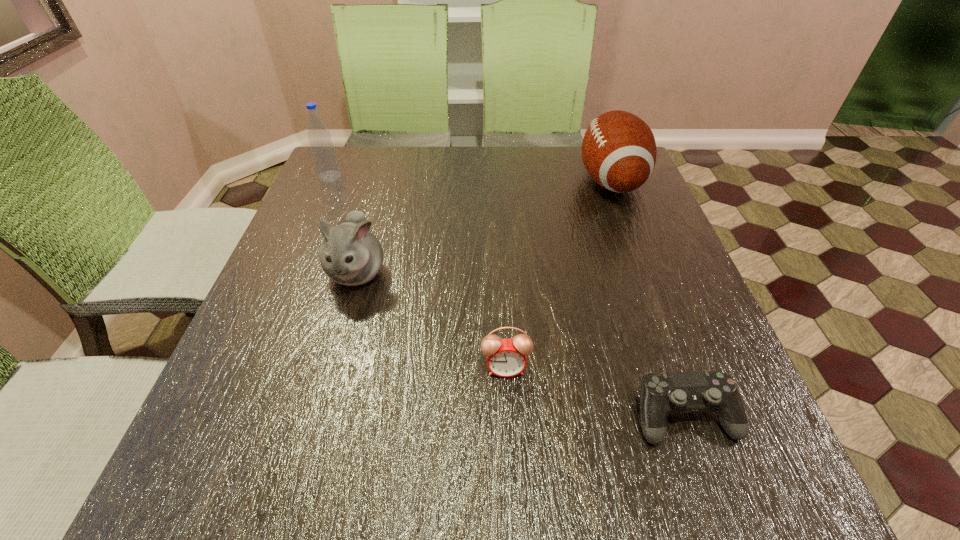
Locate an element on the screen. This screenshot has width=960, height=540. free point located 0.250m on the laces of the football is located at coordinates (487, 181).

Find the location of a particular element. This screenshot has width=960, height=540. vacant space located 0.190m on the laces of the football is located at coordinates (509, 181).

This screenshot has width=960, height=540. Find the location of `free space located on the face of the hamster`. free space located on the face of the hamster is located at coordinates (328, 374).

Locate an element on the screen. This screenshot has width=960, height=540. free spot located on the clock face of the fourth farthest object is located at coordinates (510, 464).

This screenshot has width=960, height=540. Identify the location of blank space located on the back of the nearest object. (648, 311).

Identify the location of water bottle present at the far edge. (323, 152).

Where is `football at the far edge`? Image resolution: width=960 pixels, height=540 pixels. football at the far edge is located at coordinates (x=619, y=151).

Where is `object that is at the near edge`? object that is at the near edge is located at coordinates (661, 394).

You are a GUI agent. You are given a task and a screenshot of the screen. Output one action in this format:
    pyautogui.click(x=<x>, y=<y>)
    Task: Click on the water bottle present at the left edge
    The width and height of the screenshot is (960, 540).
    Given the screenshot: What is the action you would take?
    pyautogui.click(x=323, y=152)

Locate an element on the screen. The height and width of the screenshot is (540, 960). hamster that is positioned at the left edge is located at coordinates (351, 254).